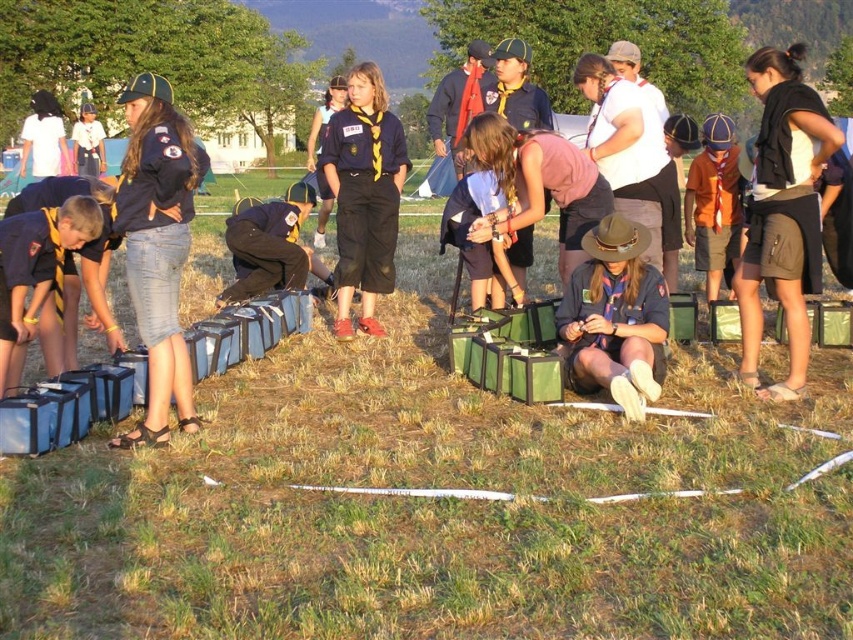
Between point (701, 605) and point (144, 428), which one is positioned behind?

Positioned behind is point (144, 428).

Can you confirm if green grass at center is bigger than matte black uniform at center?

No, green grass at center is not bigger than matte black uniform at center.

The height and width of the screenshot is (640, 853). Describe the element at coordinates (434, 506) in the screenshot. I see `green grass at center` at that location.

What are the coordinates of `green grass at center` in the screenshot? It's located at (434, 506).

Can you confirm if matte black uniform at center is shorter than matte blue uniform at center?

Incorrect, matte black uniform at center's height does not fall short of matte blue uniform at center's.

In order to click on matte black uniform at center in this screenshot , I will do `click(614, 308)`.

Who is more forward, (155, 435) or (498, 250)?

Positioned in front is point (155, 435).

In order to click on matte black uniform at center in this screenshot , I will do `click(614, 308)`.

Can you confirm if green grass at center is shorter than matte blue uniform at center?

Correct, green grass at center is not as tall as matte blue uniform at center.

Between point (560, 570) and point (477, 182), which one is positioned behind?

Positioned behind is point (477, 182).

Locate an element on the screen. green grass at center is located at coordinates (434, 506).